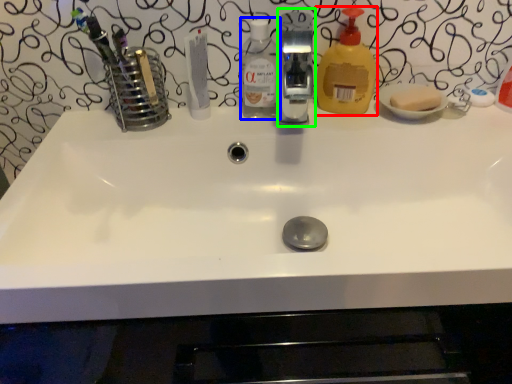
Question: Estimate the real-world distances between objects in this image. Which object is farther from cleaning product (highlighted by a red box), bottle (highlighted by a blue box) or fixture (highlighted by a green box)?

Choices:
 (A) bottle
 (B) fixture

Answer: (B)